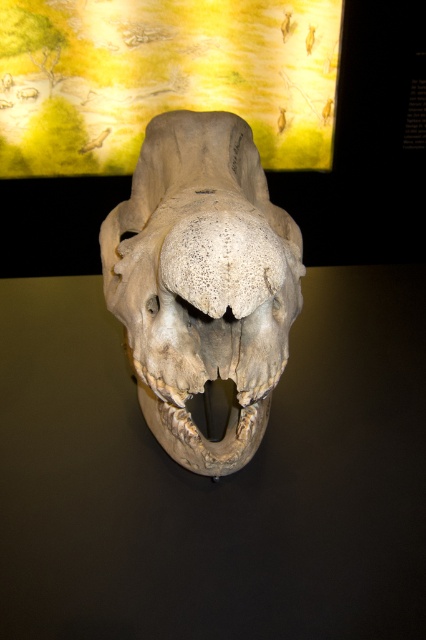
Can you confirm if transparent glass skull at center is thinner than gray textured skull at center?

No, transparent glass skull at center is not thinner than gray textured skull at center.

Is transparent glass skull at center in front of gray textured skull at center?

No, transparent glass skull at center is behind gray textured skull at center.

Who is more distant from viewer, (x=383, y=628) or (x=235, y=237)?

The point (x=383, y=628) is behind.

At what (x,y) coordinates should I click in order to perform the action: click on transparent glass skull at center. Please return your answer as a coordinate pair (x, y). This screenshot has width=426, height=640. Looking at the image, I should click on coord(215,483).